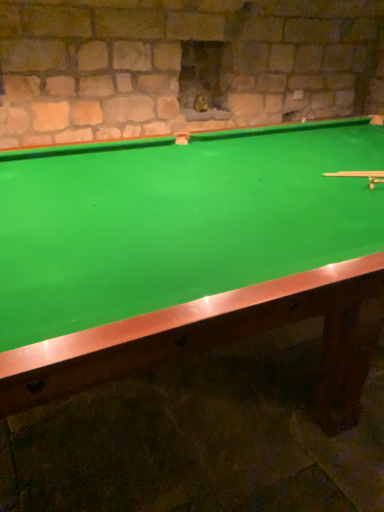
This screenshot has height=512, width=384. Describe the element at coordinates (188, 255) in the screenshot. I see `green felt billiard table at center` at that location.

Where is `green felt billiard table at center`? This screenshot has height=512, width=384. green felt billiard table at center is located at coordinates (188, 255).

From the picture: Measure the distance between green felt billiard table at center and camera.

green felt billiard table at center and camera are 78.26 centimeters apart.

Locate an element on the screen. This screenshot has width=384, height=512. green felt billiard table at center is located at coordinates (188, 255).